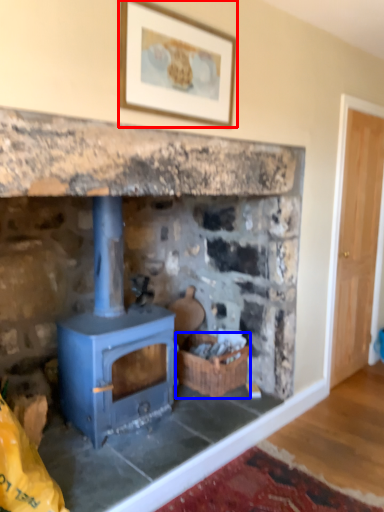
Question: Which point is closer to the camera, picture frame (highlighted by a red box) or basket (highlighted by a blue box)?

Choices:
 (A) picture frame
 (B) basket

Answer: (A)